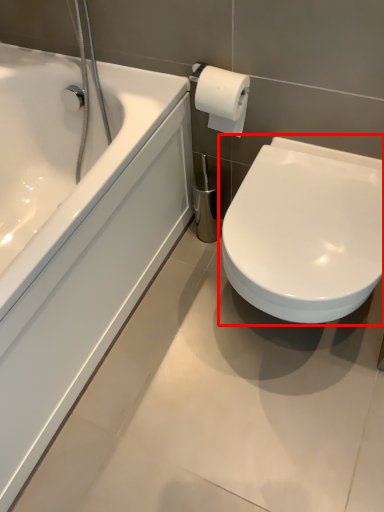
Question: In this image, where is toilet (annotated by the red box) located relative to bathtub?

Choices:
 (A) left
 (B) right

Answer: (B)